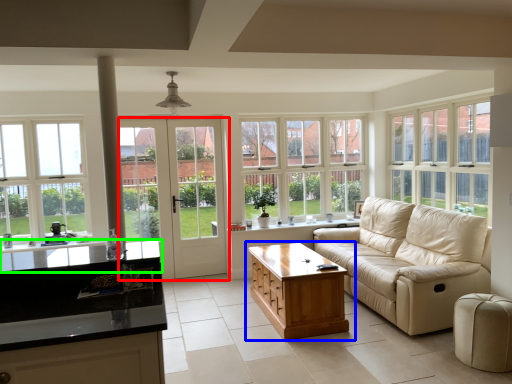
Question: Which object is positioned farthest from door (highlighted by a red box)? Select from table (highlighted by a blue box) and countertop (highlighted by a green box).

Choices:
 (A) table
 (B) countertop

Answer: (B)